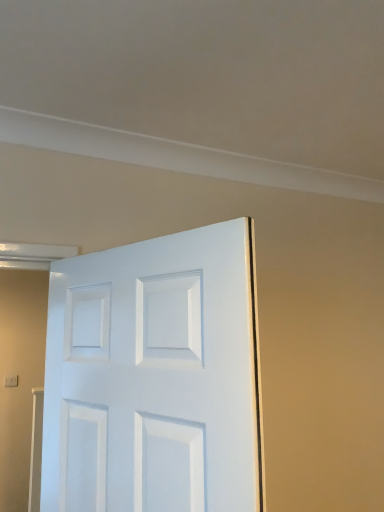
You are a GUI agent. You are given a task and a screenshot of the screen. Output one action in this format:
    pyautogui.click(x=<x>, y=<y>)
    Task: Click on the white glossy door at center
    Image resolution: width=384 pixels, height=512 pixels.
    Given the screenshot: What is the action you would take?
    pyautogui.click(x=155, y=377)

What do you see at coordinates (155, 377) in the screenshot? The width and height of the screenshot is (384, 512). I see `white glossy door at center` at bounding box center [155, 377].

The image size is (384, 512). I want to click on white glossy door at center, so click(155, 377).